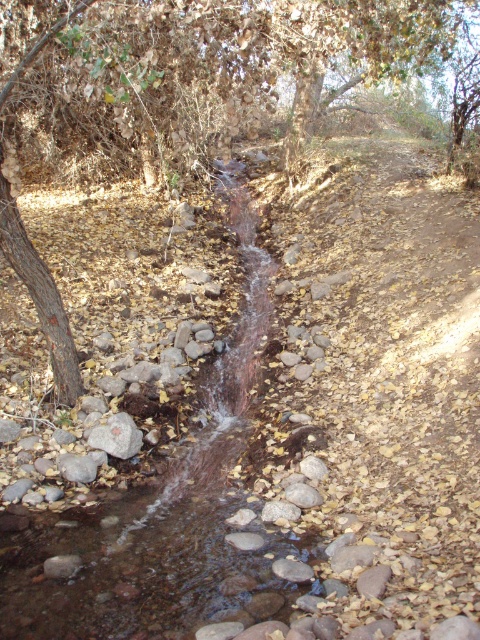
Question: Does clear water stream at center appear over gray smooth rock at center-left?

Choices:
 (A) yes
 (B) no

Answer: (A)

Question: Considering the real-world distances, which object is farthest from the clear water stream at center?

Choices:
 (A) brown textured tree at upper left
 (B) gray smooth rock at center-left

Answer: (A)

Question: Estimate the real-world distances between objects in this image. Which object is farther from the brown textured tree at upper left?

Choices:
 (A) clear water stream at center
 (B) gray smooth rock at center-left

Answer: (B)

Question: Does brown textured tree at upper left appear on the right side of gray smooth rock at center-left?

Choices:
 (A) yes
 (B) no

Answer: (A)

Question: Is brown textured tree at upper left bigger than gray smooth rock at center-left?

Choices:
 (A) no
 (B) yes

Answer: (B)

Question: Among these points, which one is farthest from the camera?

Choices:
 (A) (22, 61)
 (B) (93, 570)
 (C) (133, 444)

Answer: (C)